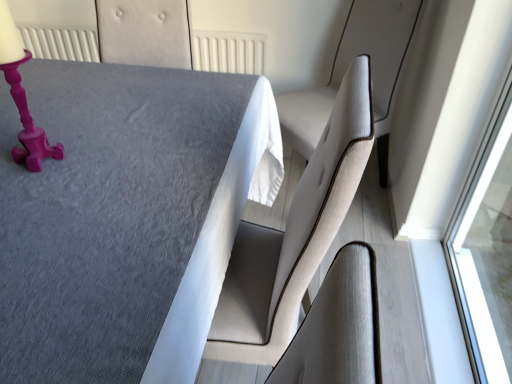
Question: Based on their sizes in the image, would you say textured gray table at center is bigger or smaller than matte pink candlestick at upper left?

Choices:
 (A) big
 (B) small

Answer: (A)

Question: Is point (55, 137) closer or farther from the camera than point (19, 99)?

Choices:
 (A) farther
 (B) closer

Answer: (A)

Question: Considering the real-world distances, which object is farthest from the matte pink candlestick at upper left?

Choices:
 (A) light beige fabric swivel chair at right
 (B) textured gray table at center

Answer: (A)

Question: Which is nearer to the matte pink candlestick at upper left?

Choices:
 (A) light beige fabric swivel chair at right
 (B) textured gray table at center

Answer: (B)